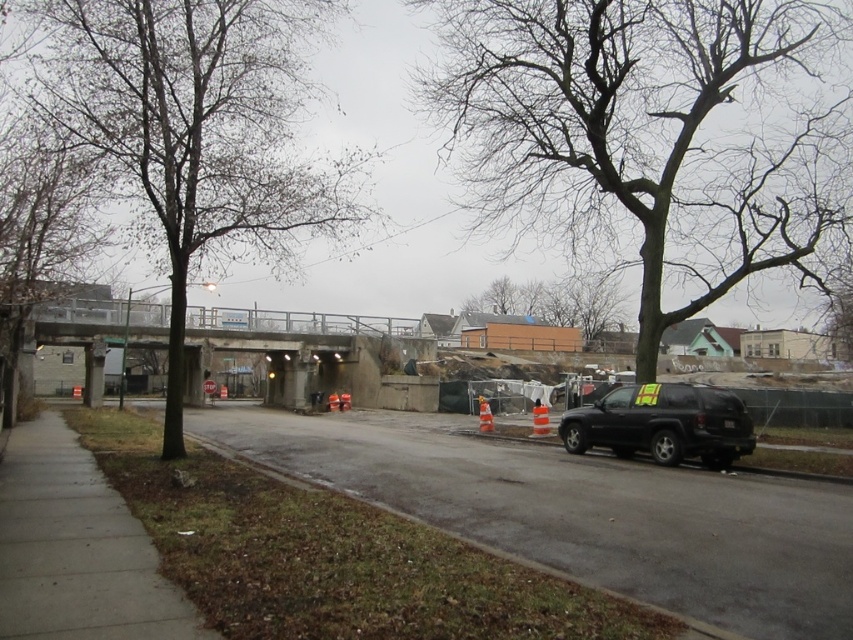
Does bare wood tree at left appear on the left side of bare branches at left?

Incorrect, bare wood tree at left is not on the left side of bare branches at left.

Can you confirm if bare wood tree at left is positioned below bare branches at left?

Incorrect, bare wood tree at left is not positioned below bare branches at left.

Who is more distant from viewer, (171, 355) or (97, 240)?

Positioned behind is point (97, 240).

The height and width of the screenshot is (640, 853). Identify the location of bare wood tree at left. (196, 131).

Is bare wood tree at left taller than black matte suv at right?

Yes.

Does bare wood tree at left lie in front of black matte suv at right?

Yes, bare wood tree at left is in front of black matte suv at right.

Locate an element on the screen. Image resolution: width=853 pixels, height=640 pixels. bare wood tree at left is located at coordinates (196, 131).

Can you confirm if gray concrete sidewalk at lower left is shorter than bare branches at left?

Yes, gray concrete sidewalk at lower left is shorter than bare branches at left.

Is gray concrete sidewalk at lower left above bare branches at left?

No.

Does point (119, 637) lie in front of point (15, 305)?

That is True.

Find the location of a particular element. This screenshot has height=640, width=853. gray concrete sidewalk at lower left is located at coordinates (77, 548).